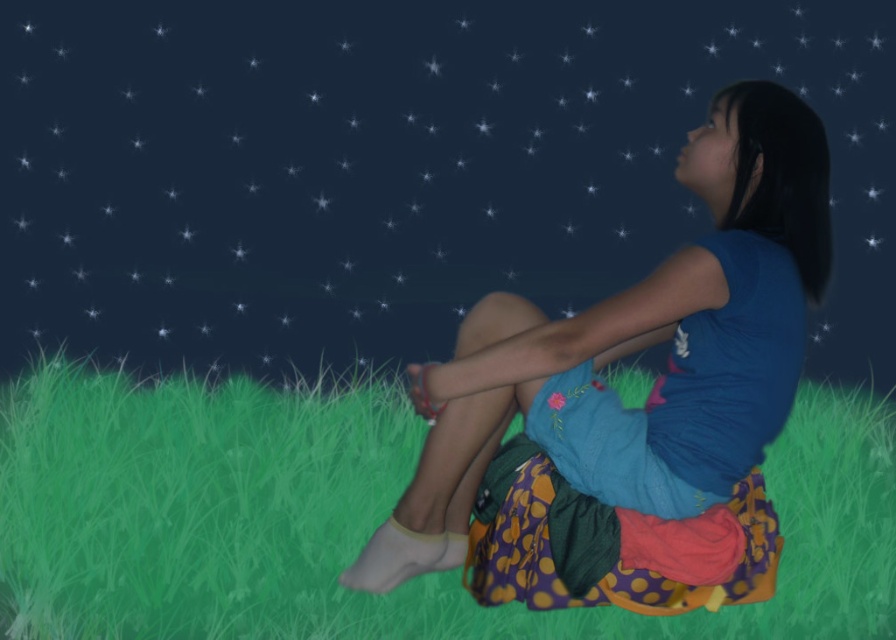
How distant is matte blue dress at center from matte blue shirt at center?

The distance of matte blue dress at center from matte blue shirt at center is 2.72 meters.

I want to click on matte blue dress at center, so click(398, 168).

Is point (316, 236) closer to viewer compared to point (752, 380)?

No, it is behind (752, 380).

At what (x,y) coordinates should I click in order to perform the action: click on matte blue dress at center. Please return your answer as a coordinate pair (x, y). Looking at the image, I should click on (398, 168).

Is matte blue dress at center positioned at the back of green grassy at lower center?

Yes, matte blue dress at center is behind green grassy at lower center.

The image size is (896, 640). What do you see at coordinates (398, 168) in the screenshot? I see `matte blue dress at center` at bounding box center [398, 168].

The height and width of the screenshot is (640, 896). Find the location of `matte blue dress at center`. matte blue dress at center is located at coordinates (398, 168).

Between green grassy at lower center and matte blue shirt at center, which one has more height?

Standing taller between the two is matte blue shirt at center.

Does green grassy at lower center appear under matte blue shirt at center?

Indeed, green grassy at lower center is positioned under matte blue shirt at center.

Describe the element at coordinates (355, 516) in the screenshot. I see `green grassy at lower center` at that location.

Where is `green grassy at lower center`? The width and height of the screenshot is (896, 640). green grassy at lower center is located at coordinates (355, 516).